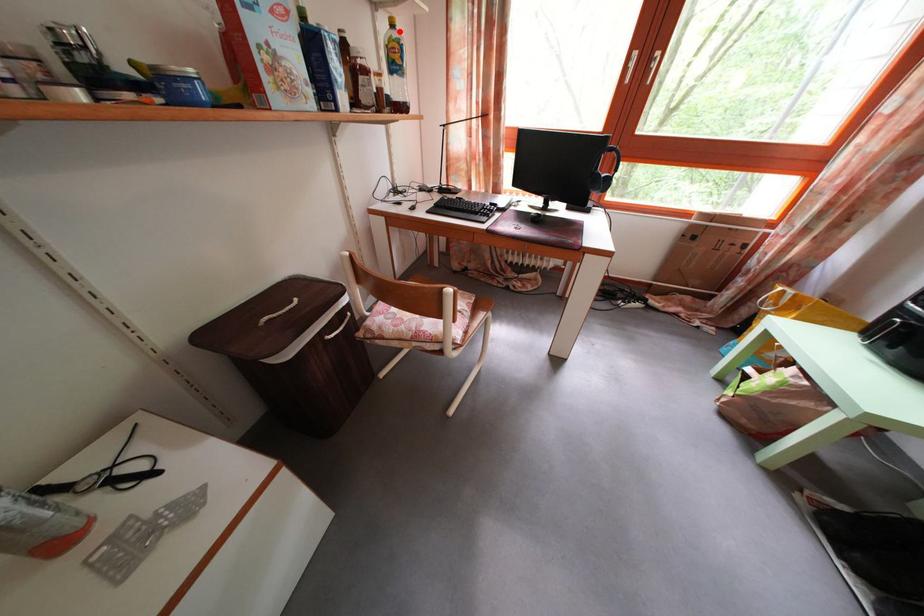
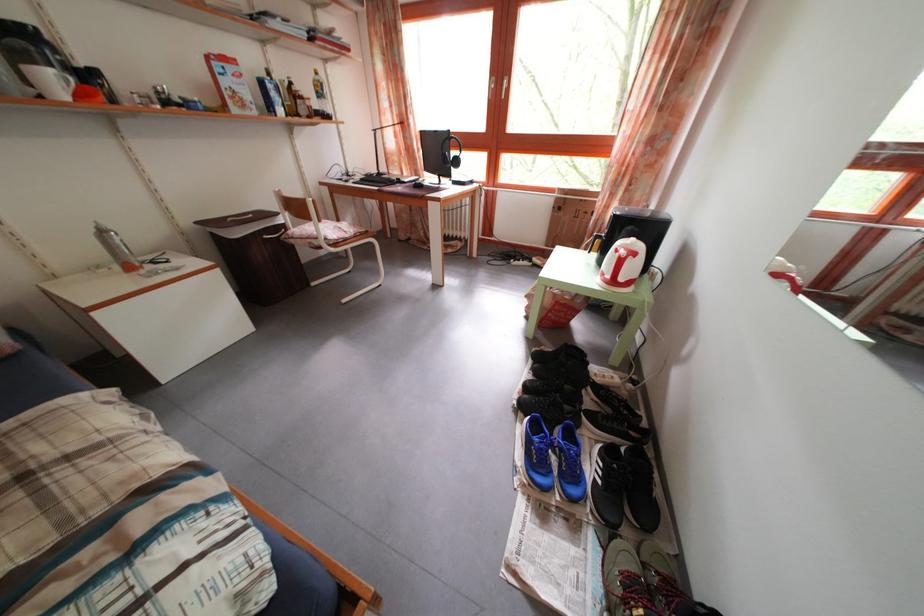
Locate, in the second image, the point that corresponds to the highlighted location in the first image.

(323, 79)